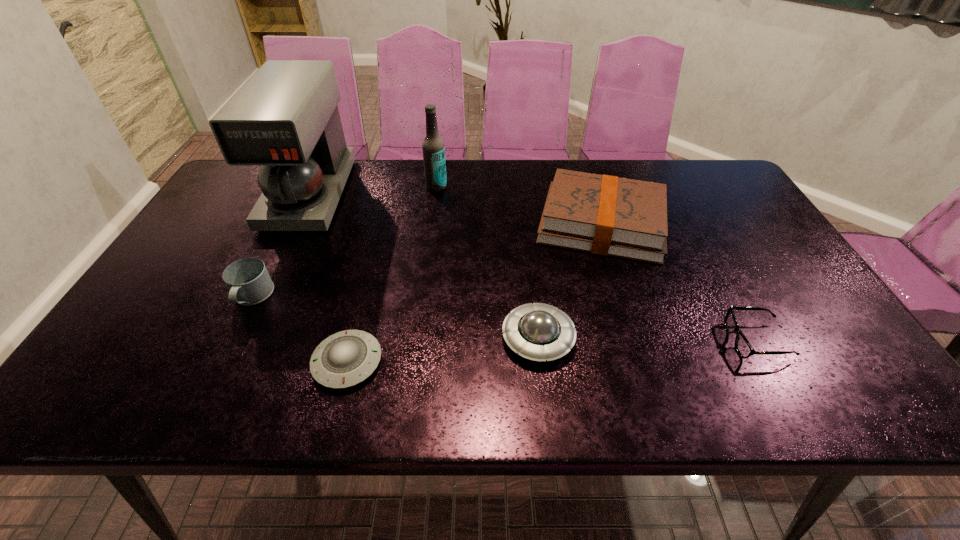
Locate an element on the screen. The height and width of the screenshot is (540, 960). free space that satisfies the following two spatial constraints: 1. on the carafe side of the coffee maker; 2. on the right side of the taller saucer is located at coordinates (242, 338).